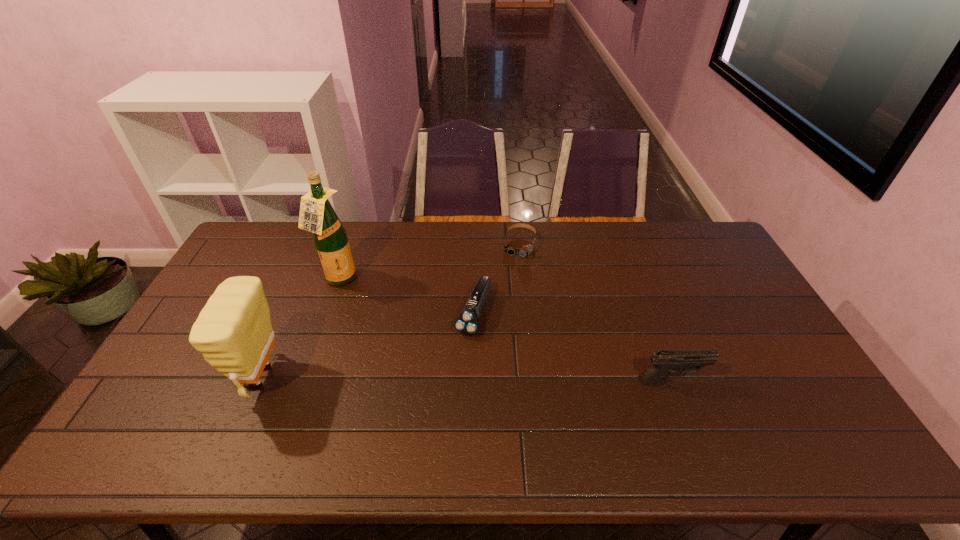
The image size is (960, 540). Identify the location of free space on the desktop that is between the sponge and the rightmost object and is positioned on the front-facing side of the tallest object. (463, 379).

Locate an element on the screen. The image size is (960, 540). vacant space on the desktop that is between the sponge and the third tallest object and is positioned on the front-facing side of the fourth object from left to right is located at coordinates (486, 379).

Locate an element on the screen. The image size is (960, 540). vacant space on the desktop that is between the sponge and the pistol and is positioned on the head of the third object from right to left is located at coordinates (445, 379).